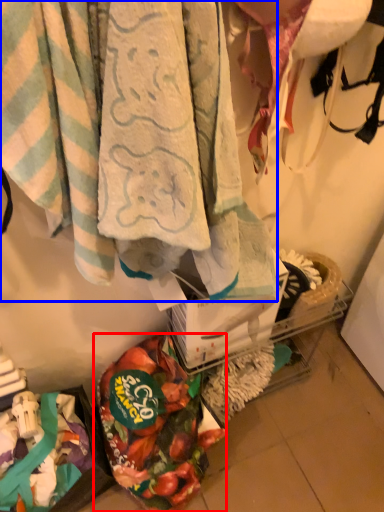
Question: Which object appears farthest to the camera in this image, food (highlighted by a red box) or towel (highlighted by a blue box)?

Choices:
 (A) food
 (B) towel

Answer: (A)